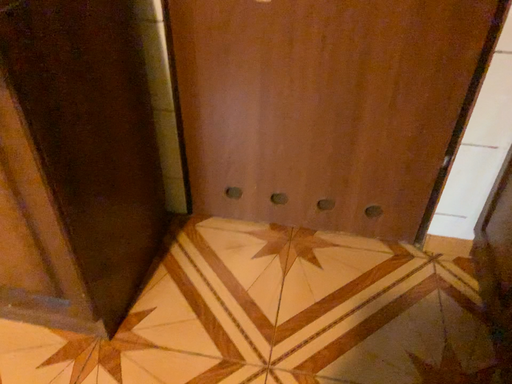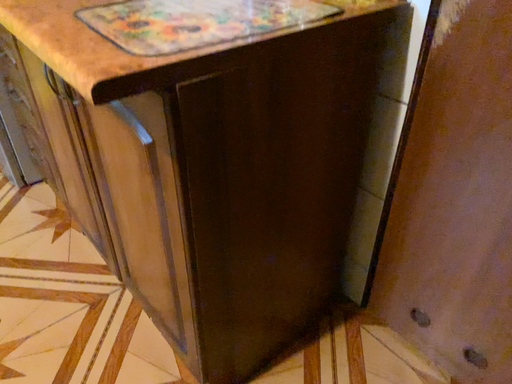
Question: How did the camera likely rotate when shooting the video?

Choices:
 (A) rotated upward
 (B) rotated downward

Answer: (A)